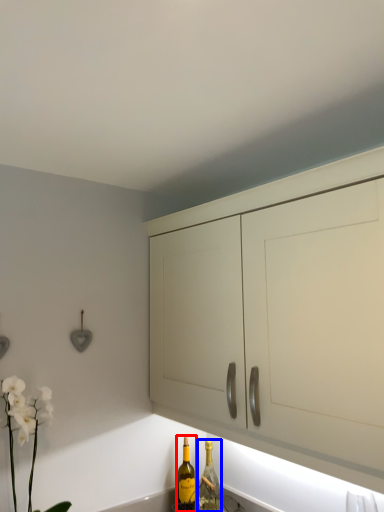
Question: Which object is closer to the camera taking this photo, bottle (highlighted by a red box) or bottle (highlighted by a blue box)?

Choices:
 (A) bottle
 (B) bottle

Answer: (A)